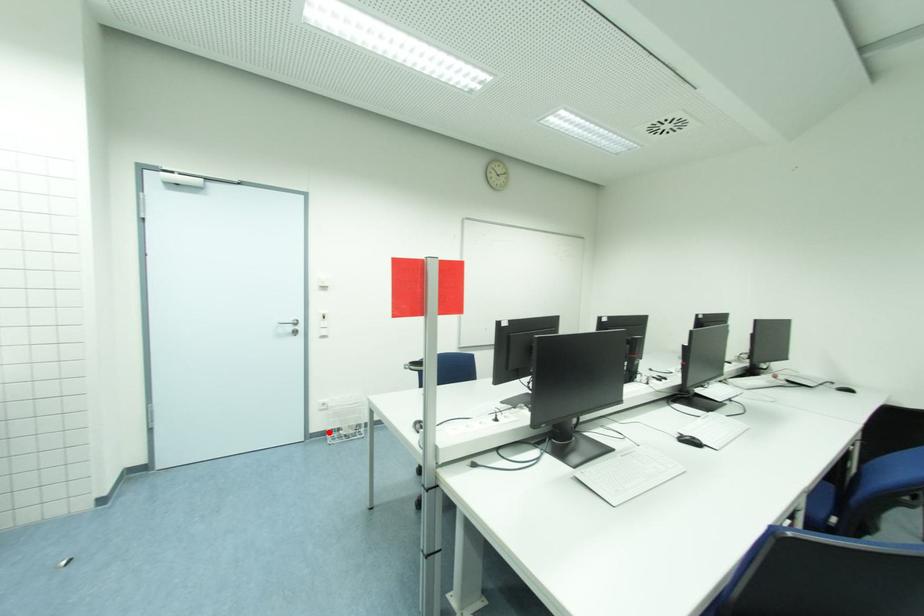
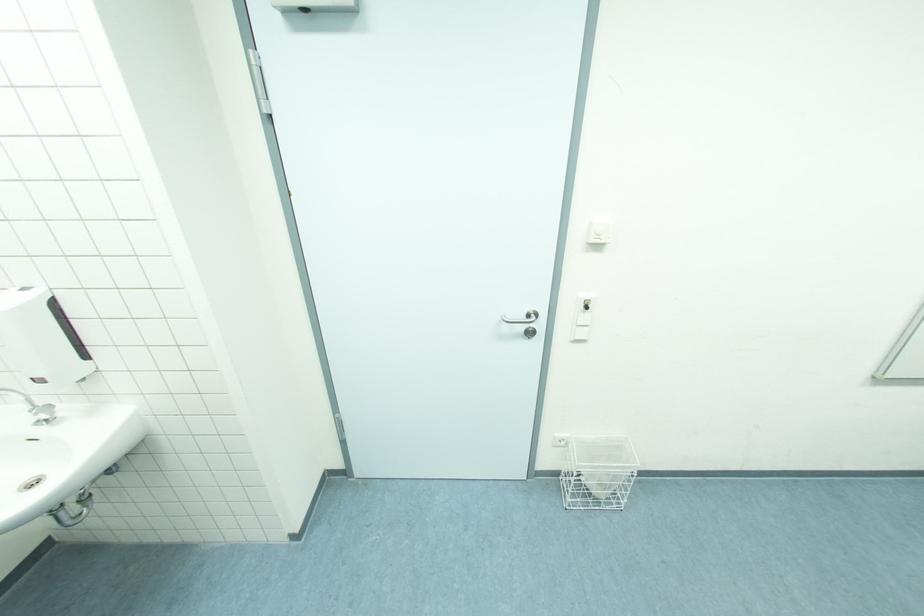
Question: I am providing you with two images of the same scene from different viewpoints. A red point is shown in image1. For the corresponding object point in image2, is it positioned nearer or farther from the camera?

Choices:
 (A) Nearer
 (B) Farther

Answer: (B)